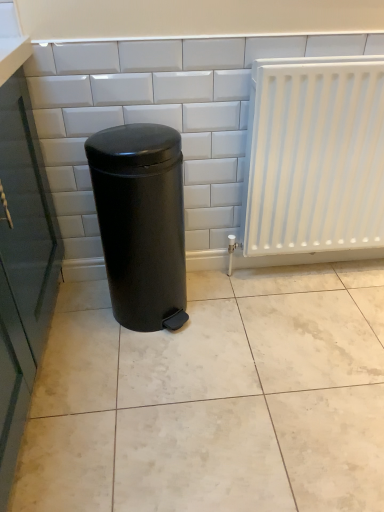
Where is `white glossy tile at center`? Image resolution: width=384 pixels, height=512 pixels. white glossy tile at center is located at coordinates (159, 118).

Does black matte waste container at center turn towards white glossy tile at center?

No, black matte waste container at center is not oriented towards white glossy tile at center.

From the image's perspective, relative to white glossy tile at center, is black matte waste container at center above or below?

From the image's perspective, black matte waste container at center appears below white glossy tile at center.

Based on their sizes in the image, would you say black matte waste container at center is bigger or smaller than white glossy tile at center?

Clearly, black matte waste container at center is larger in size than white glossy tile at center.

From the picture: From the image's perspective, would you say black matte waste container at center is shown under white matte radiator at right?

Yes, from the image's perspective, black matte waste container at center is below white matte radiator at right.

Between black matte waste container at center and white matte radiator at right, which one has more height?

With more height is white matte radiator at right.

From a real-world perspective, is black matte waste container at center under white matte radiator at right?

Yes.

How many degrees apart are the facing directions of black matte waste container at center and white matte radiator at right?

The facing directions of black matte waste container at center and white matte radiator at right are 0.931 degrees apart.

From a real-world perspective, is white matte radiator at right under black matte waste container at center?

Actually, white matte radiator at right is physically above black matte waste container at center in the real world.

Does white matte radiator at right appear on the left side of black matte waste container at center?

No, white matte radiator at right is not to the left of black matte waste container at center.

Does point (284, 79) appear closer or farther from the camera than point (123, 127)?

Point (284, 79) is positioned closer to the camera compared to point (123, 127).

Consider the image. Is white matte radiator at right facing towards black matte waste container at center?

No, white matte radiator at right is not facing towards black matte waste container at center.

How much distance is there between white glossy tile at center and black matte waste container at center?

white glossy tile at center and black matte waste container at center are 10.57 inches apart from each other.

Could black matte waste container at center be considered to be inside white glossy tile at center?

No, white glossy tile at center does not contain black matte waste container at center.

From a real-world perspective, between white glossy tile at center and black matte waste container at center, who is vertically lower?

black matte waste container at center, from a real-world perspective.

Is white glossy tile at center at the left side of white matte radiator at right?

Indeed, white glossy tile at center is positioned on the left side of white matte radiator at right.

Does white glossy tile at center have a greater width compared to white matte radiator at right?

Incorrect, the width of white glossy tile at center does not surpass that of white matte radiator at right.

In terms of size, does white glossy tile at center appear bigger or smaller than white matte radiator at right?

white glossy tile at center is smaller than white matte radiator at right.

Is point (89, 120) closer to viewer compared to point (247, 202)?

Yes, it is.

Would you say white matte radiator at right is to the left or to the right of white glossy tile at center in the picture?

white matte radiator at right is positioned on white glossy tile at center's right side.

Is white matte radiator at right not within white glossy tile at center?

white matte radiator at right lies outside white glossy tile at center's area.

From the image's perspective, relative to white glossy tile at center, is white matte radiator at right above or below?

From the image's perspective, white matte radiator at right appears below white glossy tile at center.

Looking at this image, which object is closer to the camera, white matte radiator at right or white glossy tile at center?

white matte radiator at right is closer to the camera.

Where is `waste container that appears below the white glossy tile at center (from a real-world perspective)`? This screenshot has height=512, width=384. waste container that appears below the white glossy tile at center (from a real-world perspective) is located at coordinates (141, 222).

The height and width of the screenshot is (512, 384). What are the coordinates of `radiator located above the black matte waste container at center (from a real-world perspective)` in the screenshot? It's located at (314, 156).

When comparing their distances from white glossy tile at center, does white matte radiator at right or black matte waste container at center seem closer?

Among the two, black matte waste container at center is located nearer to white glossy tile at center.

Which object lies further to the anchor point white matte radiator at right, black matte waste container at center or white glossy tile at center?

black matte waste container at center lies further to white matte radiator at right than the other object.

Looking at this image, estimate the real-world distances between objects in this image. Which object is closer to white glossy tile at center, black matte waste container at center or white matte radiator at right?

black matte waste container at center lies closer to white glossy tile at center than the other object.

Considering their positions, is white glossy tile at center positioned further to black matte waste container at center than white matte radiator at right?

white matte radiator at right.

When comparing their distances from white matte radiator at right, does white glossy tile at center or black matte waste container at center seem further?

Among the two, black matte waste container at center is located further to white matte radiator at right.

Based on the photo, based on their spatial positions, is white matte radiator at right or white glossy tile at center further from black matte waste container at center?

Among the two, white matte radiator at right is located further to black matte waste container at center.

Find the location of a particular element. This screenshot has width=384, height=512. ceramic tile located between black matte waste container at center and white matte radiator at right in the left-right direction is located at coordinates (159, 118).